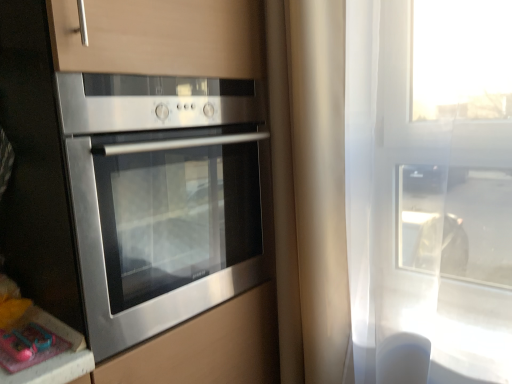
Question: Considering the relative sizes of pink plastic toy at lower left and stainless steel oven at left in the image provided, is pink plastic toy at lower left taller than stainless steel oven at left?

Choices:
 (A) yes
 (B) no

Answer: (B)

Question: Is pink plastic toy at lower left far from stainless steel oven at left?

Choices:
 (A) yes
 (B) no

Answer: (B)

Question: Considering the relative positions of pink plastic toy at lower left and stainless steel oven at left in the image provided, is pink plastic toy at lower left to the left of stainless steel oven at left from the viewer's perspective?

Choices:
 (A) no
 (B) yes

Answer: (B)

Question: Considering the relative positions of pink plastic toy at lower left and stainless steel oven at left in the image provided, is pink plastic toy at lower left in front of stainless steel oven at left?

Choices:
 (A) yes
 (B) no

Answer: (B)

Question: Does pink plastic toy at lower left have a larger size compared to stainless steel oven at left?

Choices:
 (A) yes
 (B) no

Answer: (B)

Question: From the image's perspective, is pink plastic toy at lower left located above stainless steel oven at left?

Choices:
 (A) no
 (B) yes

Answer: (A)

Question: From a real-world perspective, is stainless steel oven at left below pink plastic toy at lower left?

Choices:
 (A) no
 (B) yes

Answer: (A)

Question: Is stainless steel oven at left not within pink plastic toy at lower left?

Choices:
 (A) yes
 (B) no

Answer: (A)

Question: Considering the relative positions of stainless steel oven at left and pink plastic toy at lower left in the image provided, is stainless steel oven at left in front of pink plastic toy at lower left?

Choices:
 (A) no
 (B) yes

Answer: (B)

Question: Does stainless steel oven at left have a greater width compared to pink plastic toy at lower left?

Choices:
 (A) yes
 (B) no

Answer: (A)

Question: Is stainless steel oven at left turned away from pink plastic toy at lower left?

Choices:
 (A) yes
 (B) no

Answer: (B)

Question: Could you tell me if stainless steel oven at left is turned towards pink plastic toy at lower left?

Choices:
 (A) yes
 (B) no

Answer: (B)

Question: Would you say stainless steel oven at left is to the left or to the right of pink plastic toy at lower left in the picture?

Choices:
 (A) right
 (B) left

Answer: (A)